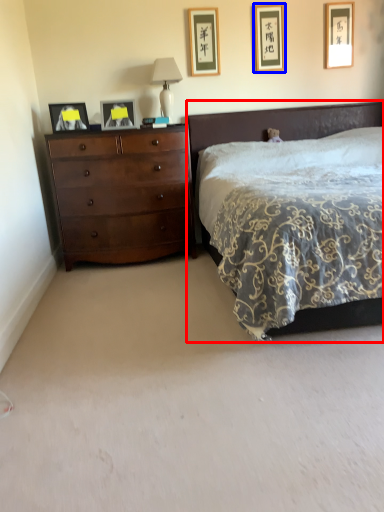
Question: Among these objects, which one is nearest to the camera, bed (highlighted by a red box) or picture frame (highlighted by a blue box)?

Choices:
 (A) bed
 (B) picture frame

Answer: (A)